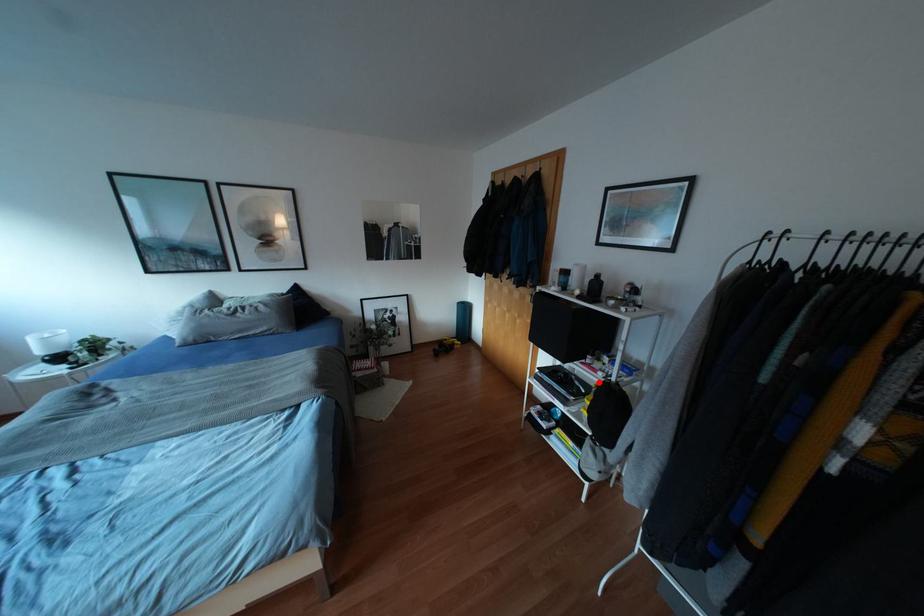
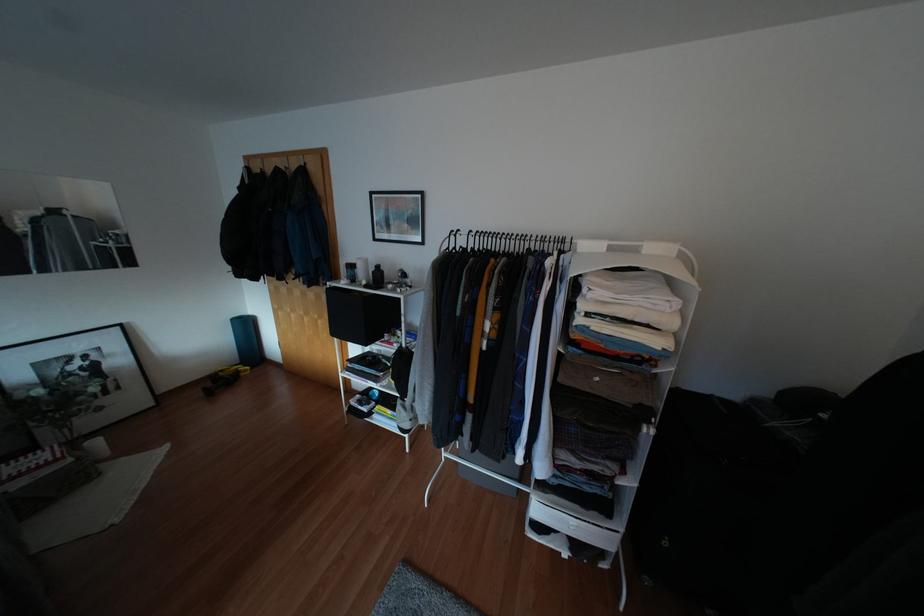
Where in the second image is the point corresponding to the highlighted location from the first image?

(394, 351)